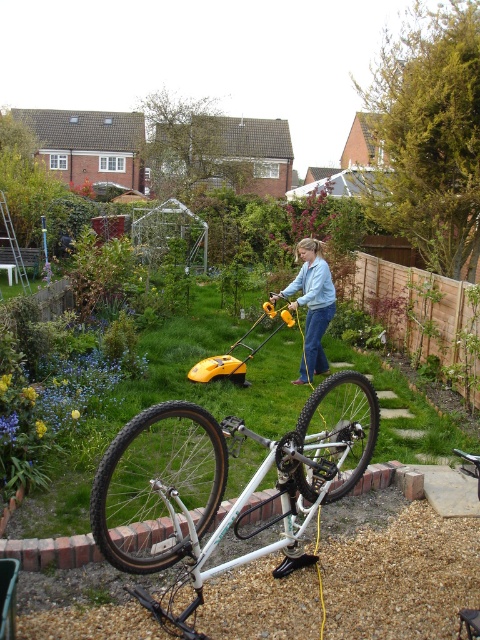
Question: Where is white metallic bicycle at center located in relation to black rubber tire at center in the image?

Choices:
 (A) right
 (B) left

Answer: (B)

Question: Can you confirm if black rubber tire at lower left is bigger than denim jacket at center?

Choices:
 (A) yes
 (B) no

Answer: (A)

Question: Which point is farther to the camera?

Choices:
 (A) white matte mountain bike at center
 (B) denim jacket at center
 (C) white metallic bicycle at center
 (D) green grass at center

Answer: (A)

Question: Which is nearer to the white metallic bicycle at center?

Choices:
 (A) white matte mountain bike at center
 (B) green grass at center

Answer: (B)

Question: Which of these objects is positioned closest to the white matte mountain bike at center?

Choices:
 (A) white metallic bicycle at center
 (B) black rubber tire at lower left
 (C) green grass at center
 (D) denim jacket at center

Answer: (D)

Question: Is black rubber tire at lower left further to the viewer compared to black rubber tire at center?

Choices:
 (A) yes
 (B) no

Answer: (B)